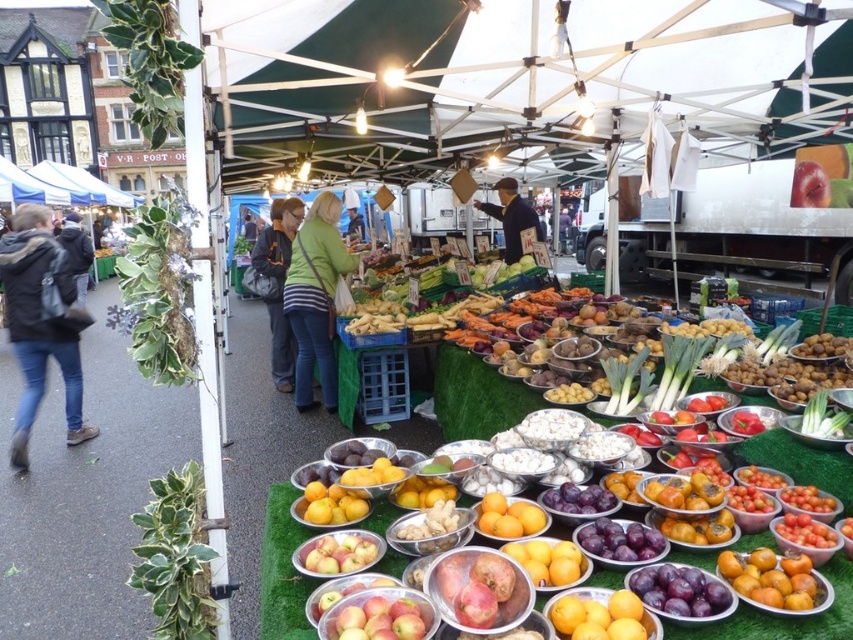
Question: Is blue fabric canopy at upper left to the left of dark blue jacket at center from the viewer's perspective?

Choices:
 (A) no
 (B) yes

Answer: (B)

Question: Is black leather jacket at left smaller than green striped sweater at center?

Choices:
 (A) no
 (B) yes

Answer: (A)

Question: Considering the real-world distances, which object is farthest from the green striped sweater at center?

Choices:
 (A) dark blue jacket at center
 (B) orange matte at center

Answer: (B)

Question: Among these objects, which one is nearest to the camera?

Choices:
 (A) green striped shirt at center
 (B) orange matte at center

Answer: (B)

Question: Considering the real-world distances, which object is closest to the green striped sweater at center?

Choices:
 (A) dark gray jacket at left
 (B) blue fabric canopy at upper left

Answer: (A)

Question: From the image, what is the correct spatial relationship of black leather jacket at left in relation to blue fabric canopy at upper left?

Choices:
 (A) above
 (B) below

Answer: (B)